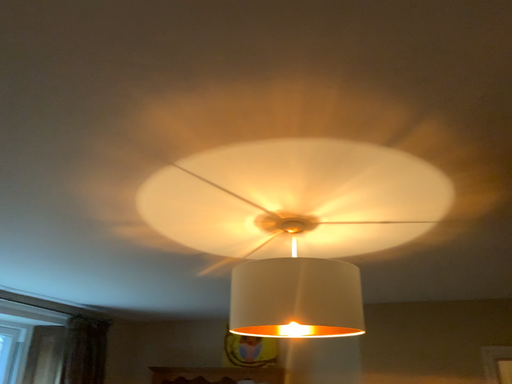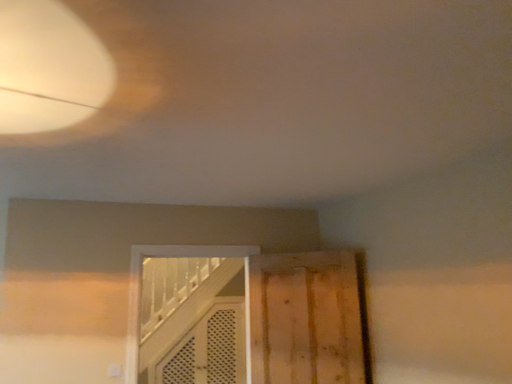
Question: Which way did the camera rotate in the video?

Choices:
 (A) rotated upward
 (B) rotated downward

Answer: (B)